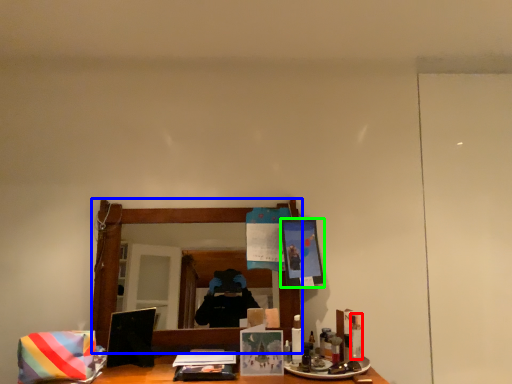
Question: Which object is positioned closest to toiletry (highlighted by a red box)? Select from mirror (highlighted by a blue box) and picture frame (highlighted by a green box).

Choices:
 (A) mirror
 (B) picture frame

Answer: (B)